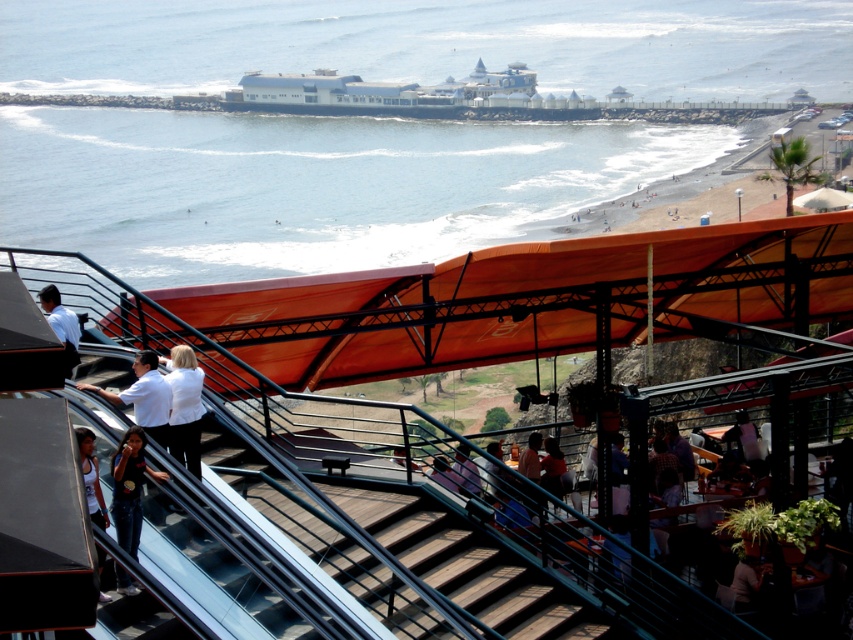
Question: Is dark blue jeans at lower left to the left of dark purple shirt at center from the viewer's perspective?

Choices:
 (A) no
 (B) yes

Answer: (B)

Question: Which point appears farthest from the camera in this image?

Choices:
 (A) pos(561,496)
 (B) pos(173,369)
 (C) pos(772,45)
 (D) pos(61,324)

Answer: (C)

Question: Which point is closer to the camera?

Choices:
 (A) dark blue shirt at center
 (B) dark blue jeans at lower left

Answer: (B)

Question: Is white matte shirt at center smaller than dark purple shirt at center?

Choices:
 (A) yes
 (B) no

Answer: (B)

Question: Does dark blue jeans at lower left appear over dark purple shirt at center?

Choices:
 (A) no
 (B) yes

Answer: (B)

Question: Which object appears farthest from the camera in this image?

Choices:
 (A) dark purple shirt at center
 (B) white shirt at lower left
 (C) dark blue shirt at center

Answer: (C)